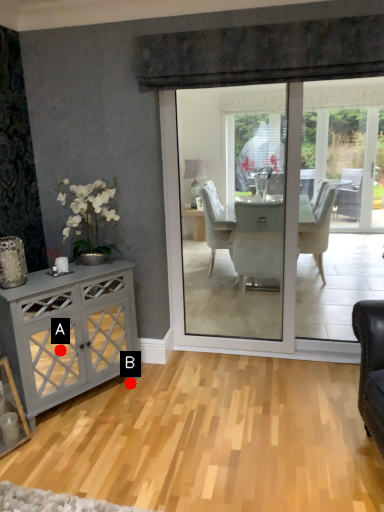
Question: Two points are circled on the image, labeled by A and B beside each circle. Which point is farther from the camera taking this photo?

Choices:
 (A) A is further
 (B) B is further

Answer: (B)